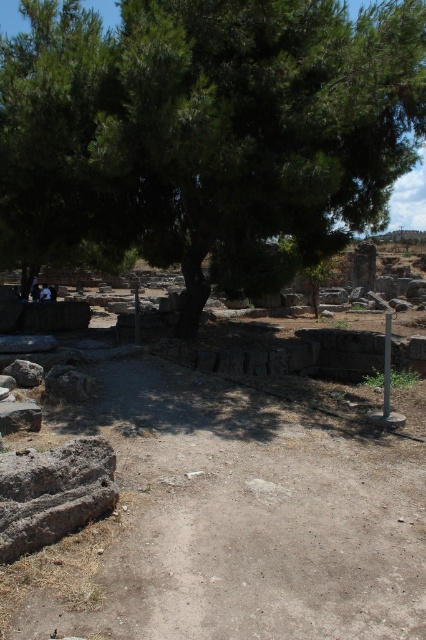
Is point (108, 256) positioned behind point (385, 330)?

That is True.

Can you confirm if green leafy tree at upper left is thinner than smooth stone pillar at center-right?

No, green leafy tree at upper left is not thinner than smooth stone pillar at center-right.

Locate an element on the screen. green leafy tree at upper left is located at coordinates (206, 132).